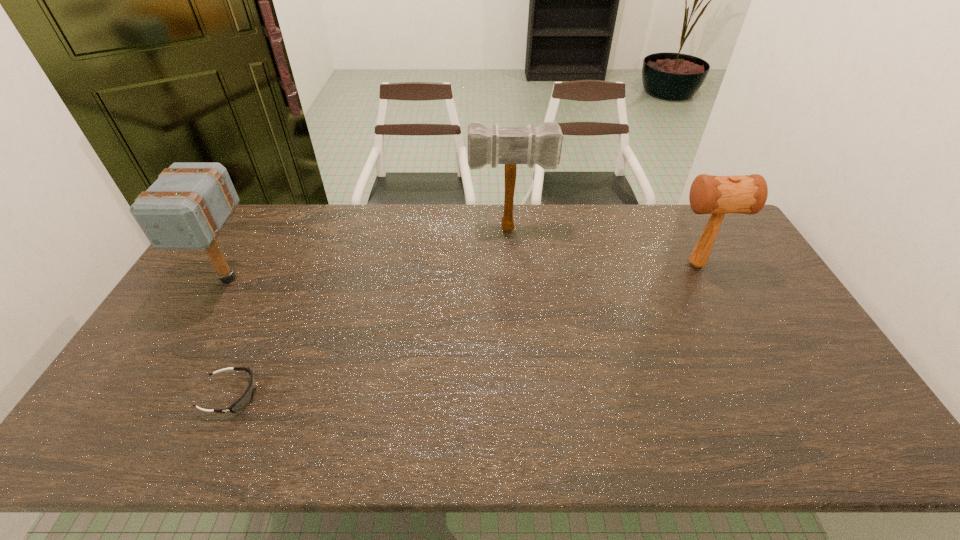
You are a GUI agent. You are given a task and a screenshot of the screen. Output one action in this format:
    pyautogui.click(x=<x>, y=<y>)
    Task: Click on the farthest mallet
    The height and width of the screenshot is (540, 960).
    Given the screenshot: What is the action you would take?
    pyautogui.click(x=494, y=145)

What are the coordinates of `the second object from right to left` in the screenshot? It's located at (494, 145).

The image size is (960, 540). Identify the location of the leftmost object. (185, 208).

Where is `the rightmost mallet`? Image resolution: width=960 pixels, height=540 pixels. the rightmost mallet is located at coordinates (709, 194).

This screenshot has width=960, height=540. Find the location of `the third object from right to left`. the third object from right to left is located at coordinates (245, 399).

You are a GUI agent. You are given a task and a screenshot of the screen. Output one action in this format:
    pyautogui.click(x=<x>, y=<y>)
    Task: Click on the shortest object
    This screenshot has width=960, height=540.
    Given the screenshot: What is the action you would take?
    pyautogui.click(x=245, y=399)

At what (x,y) coordinates should I click in order to perform the action: click on blank space located 0.400m on the right of the farthest mallet. Please return your answer as a coordinate pair (x, y). The image size is (960, 540). Looking at the image, I should click on (660, 228).

Locate an element on the screen. The image size is (960, 540). free space located 0.320m on the striking surface of the leftmost object is located at coordinates (156, 402).

At what (x,y) coordinates should I click in order to perform the action: click on free space located on the strike surface of the rightmost object. Please return your answer as a coordinate pair (x, y). Looking at the image, I should click on (561, 265).

Identify the location of free spot located on the strike surface of the rightmost object. Image resolution: width=960 pixels, height=540 pixels. (561, 265).